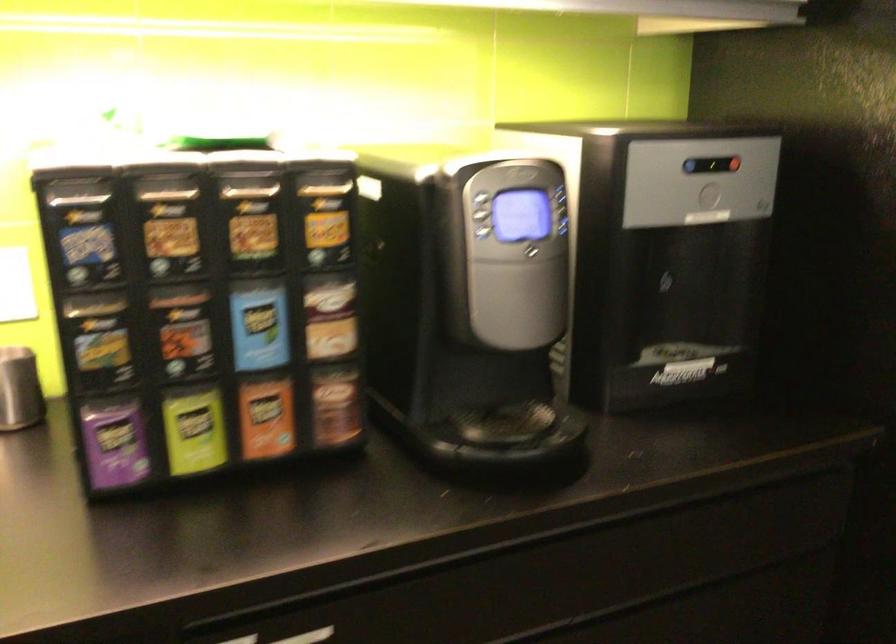
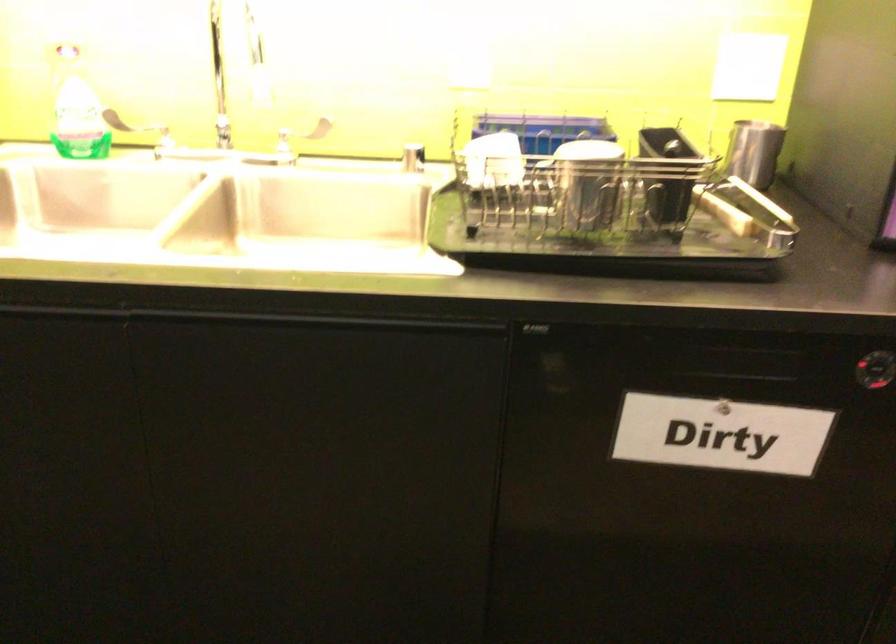
Question: The camera is either moving clockwise (left) or counter-clockwise (right) around the object. The first image is from the beginning of the video and the second image is from the end. Is the camera moving left or right when shooting the video?

Choices:
 (A) Left
 (B) Right

Answer: (B)